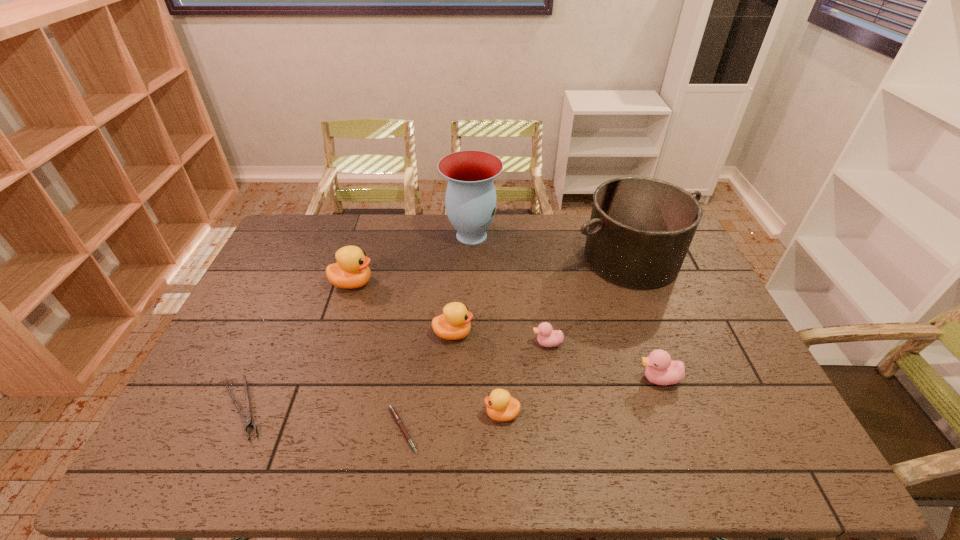
Find the location of a particular element. This screenshot has width=960, height=540. the third duckling from left to right is located at coordinates (500, 406).

At what (x,y) coordinates should I click in order to perform the action: click on the third object from right to left. Please return your answer as a coordinate pair (x, y). The height and width of the screenshot is (540, 960). Looking at the image, I should click on (547, 337).

Find the location of a particular element. The image size is (960, 540). the farther pink duckling is located at coordinates (547, 337).

The image size is (960, 540). I want to click on tongs, so click(x=248, y=422).

The image size is (960, 540). I want to click on the leftmost object, so click(x=248, y=422).

Locate an element on the screen. This screenshot has height=540, width=960. the shortest object is located at coordinates (392, 409).

Where is `pen`? The image size is (960, 540). pen is located at coordinates (392, 409).

The image size is (960, 540). Find the location of `vacant space positioned 0.140m on the front of the tallest object`. vacant space positioned 0.140m on the front of the tallest object is located at coordinates (470, 280).

Identify the location of vacant space located 0.110m on the left of the second tallest object. (537, 259).

Where is `vacant space situated on the face of the leftmost duckling`? This screenshot has height=540, width=960. vacant space situated on the face of the leftmost duckling is located at coordinates pyautogui.click(x=459, y=283).